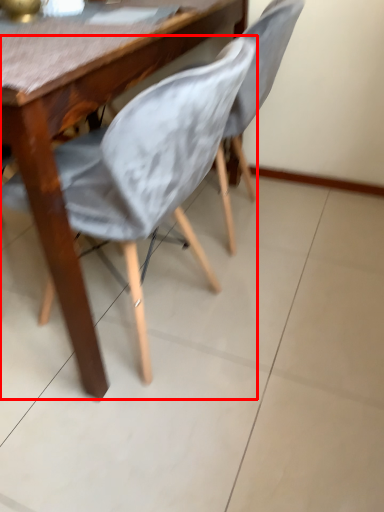
Question: In this image, where is chair (annotated by the red box) located relative to chair?

Choices:
 (A) right
 (B) left

Answer: (B)